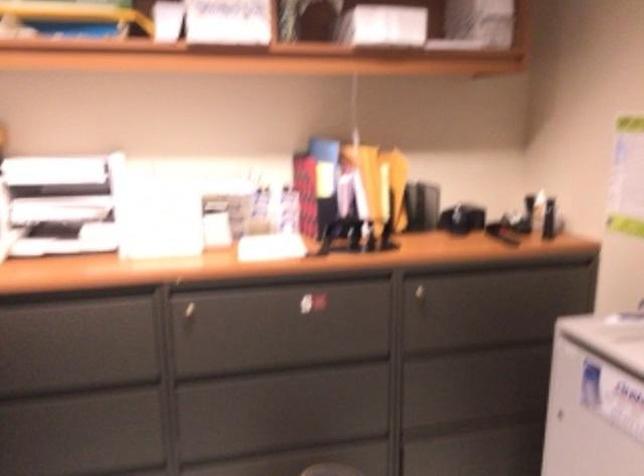
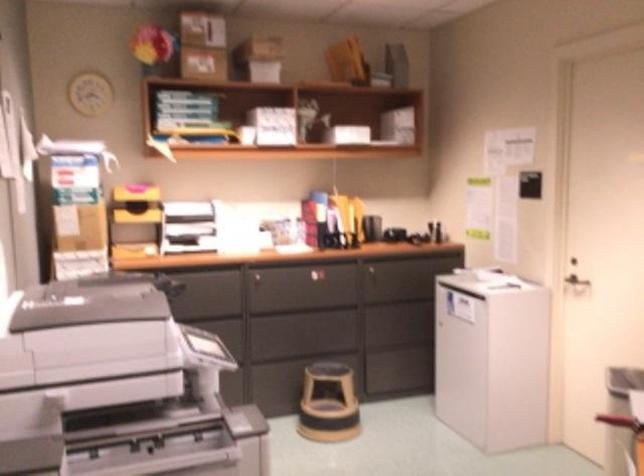
The point at [342,360] is marked in the first image. Where is the corresponding point in the second image?

(335, 307)